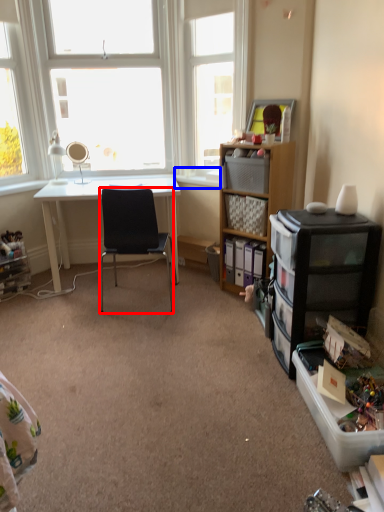
Question: Which of the following is the farthest to the observer, chair (highlighted by a red box) or window sill (highlighted by a blue box)?

Choices:
 (A) chair
 (B) window sill

Answer: (B)